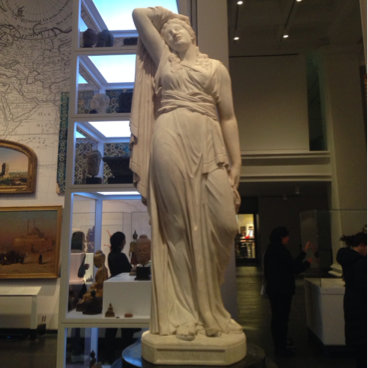
Locate an element on the screen. This screenshot has width=368, height=368. lights is located at coordinates (287, 35).